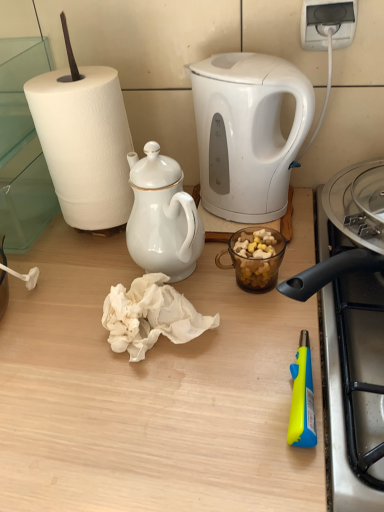
Question: Considering the relative positions of white crumpled paper towel at center and white porcelain teapot at upper center in the image provided, is white crumpled paper towel at center behind white porcelain teapot at upper center?

Choices:
 (A) yes
 (B) no

Answer: (A)

Question: Does white crumpled paper towel at center touch white porcelain teapot at upper center?

Choices:
 (A) no
 (B) yes

Answer: (B)

Question: From a real-world perspective, is white crumpled paper towel at center positioned under white porcelain teapot at upper center based on gravity?

Choices:
 (A) no
 (B) yes

Answer: (B)

Question: Is white crumpled paper towel at center taller than white porcelain teapot at upper center?

Choices:
 (A) yes
 (B) no

Answer: (B)

Question: Is white crumpled paper towel at center looking in the opposite direction of white porcelain teapot at upper center?

Choices:
 (A) no
 (B) yes

Answer: (B)

Question: Looking at the image, does white crumpled paper towel at center seem bigger or smaller compared to wooden table at center?

Choices:
 (A) big
 (B) small

Answer: (B)

Question: From the image's perspective, is white crumpled paper towel at center positioned above or below wooden table at center?

Choices:
 (A) below
 (B) above

Answer: (B)

Question: Does point (175, 305) appear closer or farther from the camera than point (281, 431)?

Choices:
 (A) closer
 (B) farther

Answer: (B)

Question: Is white crumpled paper towel at center in front of or behind wooden table at center in the image?

Choices:
 (A) front
 (B) behind

Answer: (B)

Question: Considering the positions of translucent glass mug at center and white plastic power outlet at upper right in the image, is translucent glass mug at center taller or shorter than white plastic power outlet at upper right?

Choices:
 (A) short
 (B) tall

Answer: (A)

Question: In the image, is translucent glass mug at center positioned in front of or behind white plastic power outlet at upper right?

Choices:
 (A) front
 (B) behind

Answer: (A)

Question: Based on their sizes in the image, would you say translucent glass mug at center is bigger or smaller than white plastic power outlet at upper right?

Choices:
 (A) big
 (B) small

Answer: (A)

Question: Is translucent glass mug at center inside or outside of white plastic power outlet at upper right?

Choices:
 (A) outside
 (B) inside

Answer: (A)

Question: Looking at the image, does wooden table at center seem bigger or smaller compared to translucent glass mug at center?

Choices:
 (A) big
 (B) small

Answer: (A)

Question: Is wooden table at center situated inside translucent glass mug at center or outside?

Choices:
 (A) outside
 (B) inside

Answer: (A)